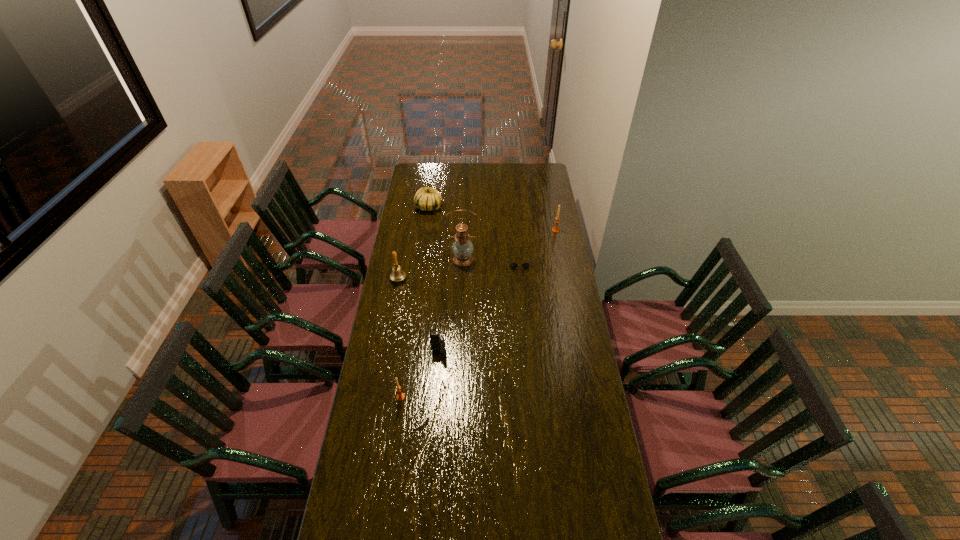
Identify the location of the shorter candle_holder. (400, 396).

I want to click on the nearest object, so click(x=400, y=396).

Locate an element on the screen. The height and width of the screenshot is (540, 960). the rightmost object is located at coordinates (555, 229).

This screenshot has width=960, height=540. In order to click on the taller candle_holder in this screenshot , I will do `click(555, 229)`.

Where is `the tallest object`? The image size is (960, 540). the tallest object is located at coordinates (462, 248).

Identify the location of the shortest object. (513, 265).

Locate an element on the screen. The image size is (960, 540). the second object from right to left is located at coordinates (513, 265).

Where is `the farthest object`? The height and width of the screenshot is (540, 960). the farthest object is located at coordinates [x=426, y=199].

I want to click on the fifth farthest object, so click(398, 274).

The width and height of the screenshot is (960, 540). I want to click on cellular telephone, so click(x=437, y=341).